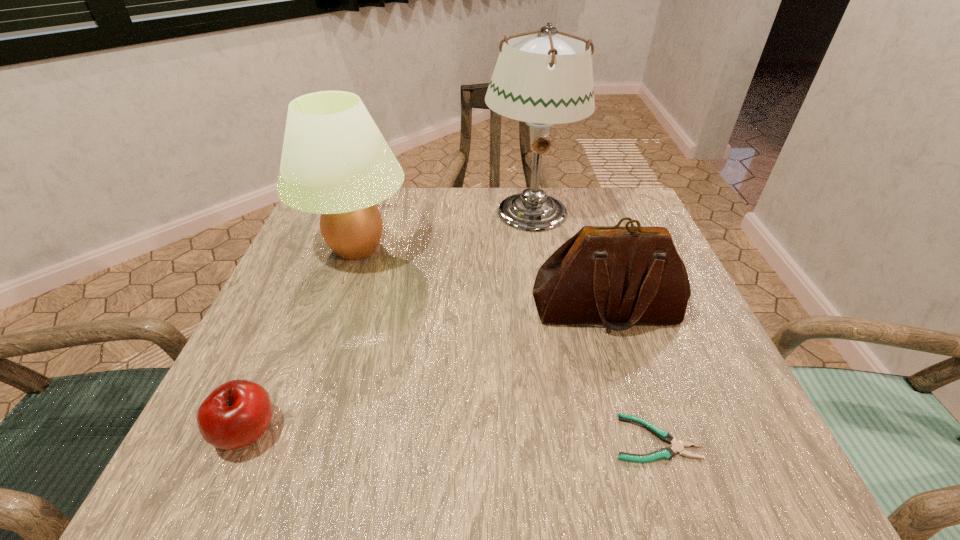
Locate an element on the screen. The image size is (960, 540). unoccupied position between the shorter lampshade and the shortest object is located at coordinates (506, 343).

Find the location of a particular element. The image size is (960, 540). free space between the second shortest object and the shoulder bag is located at coordinates (426, 370).

Identify the location of free space between the right lampshade and the second shortest object. (389, 321).

Where is `vacant area that lies between the right lampshade and the pliers`? This screenshot has width=960, height=540. vacant area that lies between the right lampshade and the pliers is located at coordinates (592, 325).

The height and width of the screenshot is (540, 960). I want to click on unoccupied position between the fourth tallest object and the right lampshade, so click(389, 321).

Choose which object is the third nearest neighbor to the taller lampshade. Please provide its 2D coordinates. Your answer should be formatted as a tuple, i.e. [(x, y)], where the tuple contains the x and y coordinates of a point satisfying the conditions above.

[(667, 453)]

The height and width of the screenshot is (540, 960). I want to click on object that is the fourth nearest to the second shortest object, so click(x=542, y=78).

I want to click on blank space that satisfies the following two spatial constraints: 1. on the lampshade of the shortest object; 2. on the left side of the taller lampshade, so click(565, 438).

Locate an element on the screen. The image size is (960, 540). vacant space that satisfies the following two spatial constraints: 1. on the front side of the apple; 2. on the right side of the shortest object is located at coordinates (243, 438).

Identify the location of vacant space that satisfies the following two spatial constraints: 1. on the lampshade of the tallest object; 2. on the left side of the shortest object. (565, 438).